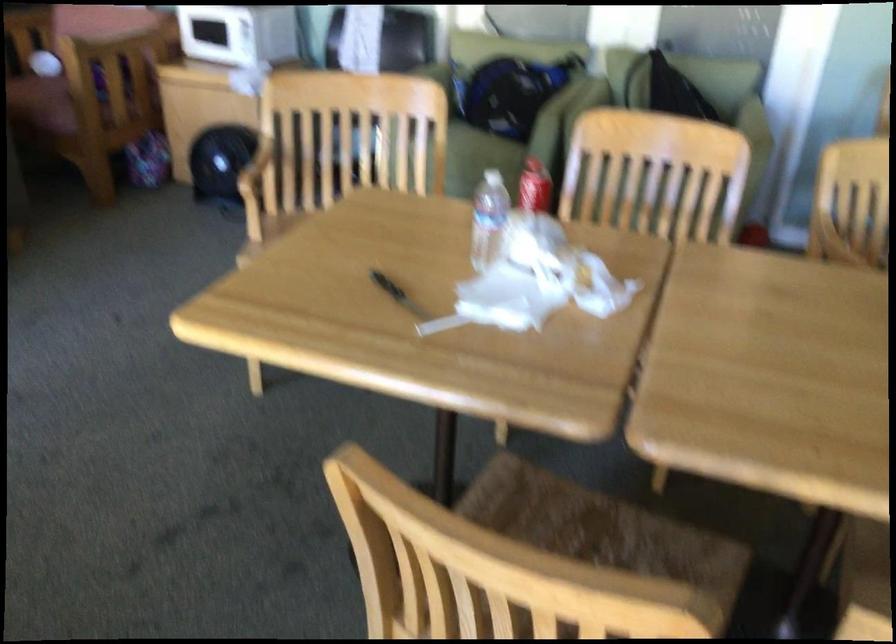
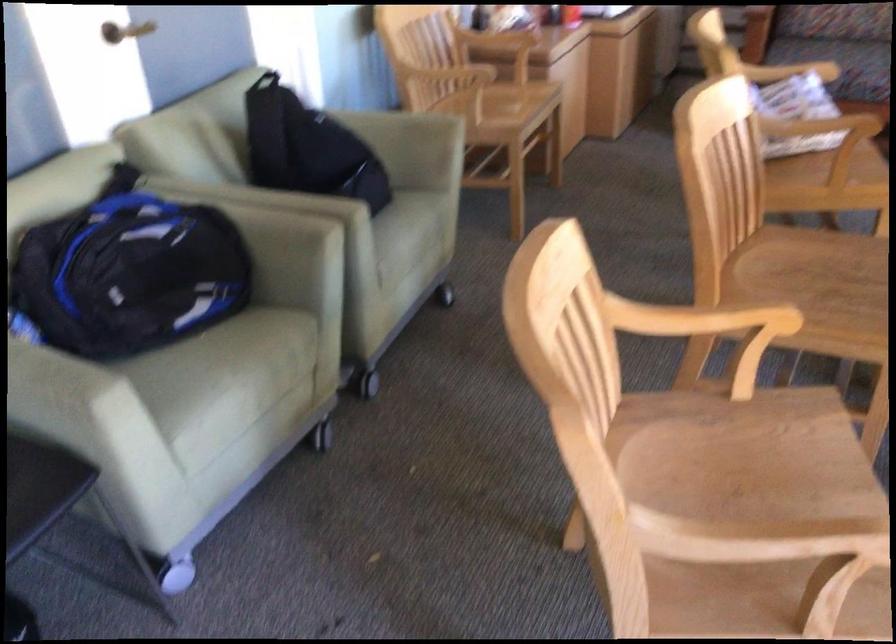
Find the pixel in the second image that matches [475,106] in the first image.

(126, 315)